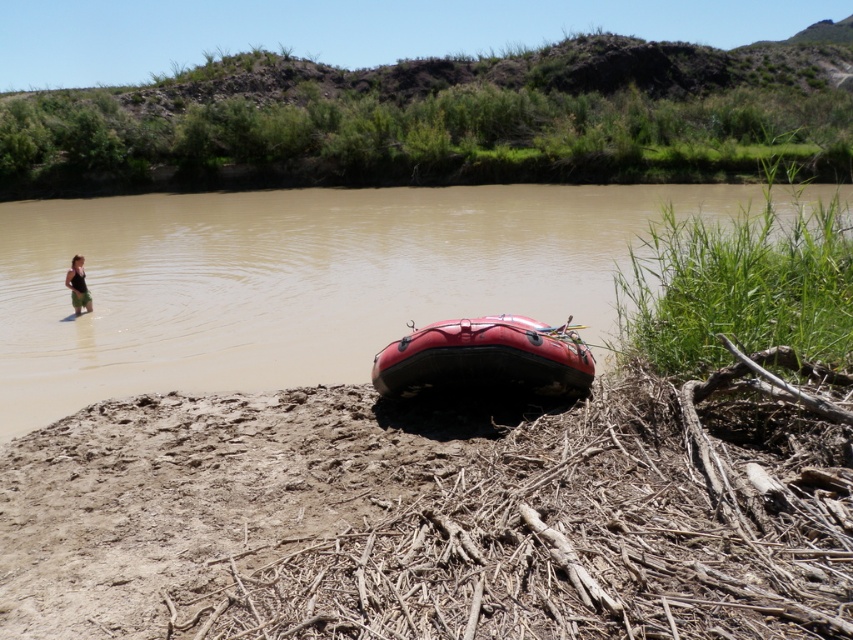
You are a swimmer wanting to cross the river. You see the brown muddy water at lower center and the rubber boat at lower center. Which one is closer to the surface of the river?

The brown muddy water at lower center is located above the rubber boat at lower center, so the brown muddy water at lower center is closer to the surface of the river.

You are planning to take a short swim in the murky river shown. You have the rubber boat at lower center and the matte black swimsuit at left available. Which item should you use to stay afloat?

The rubber boat at lower center has a larger size compared to the matte black swimsuit at left, so it is more suitable for staying afloat in the river.

You are planning to take a swim in the river. You see the brown muddy water at lower center and the matte black swimsuit at left. Which object takes up more space in the image?

The brown muddy water at lower center takes up more space in the image as it is bigger than the matte black swimsuit at left.